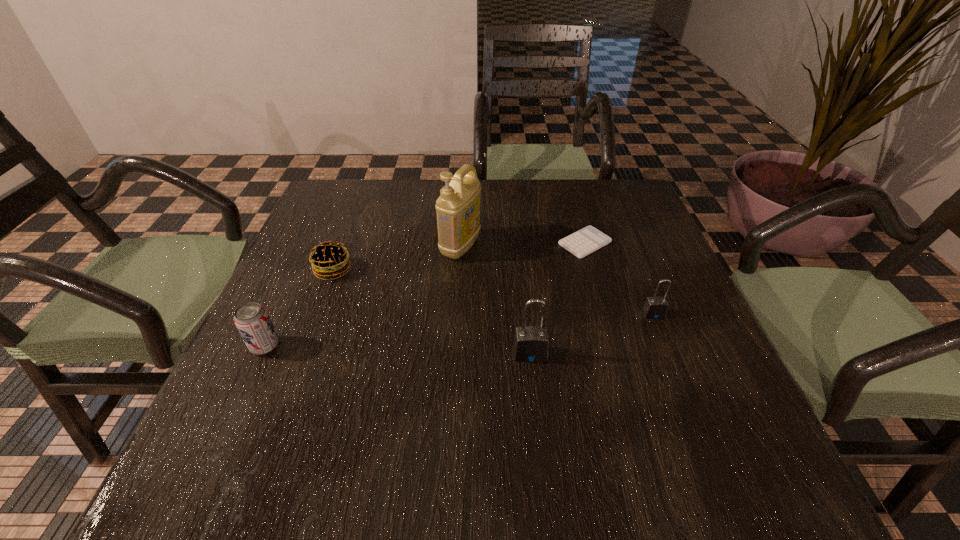
Find the location of a particular element. This screenshot has width=960, height=540. vacant area that lies between the detergent and the second shortest object is located at coordinates (396, 258).

The width and height of the screenshot is (960, 540). What are the coordinates of `vacant point located between the shorter padlock and the taller padlock` in the screenshot? It's located at point(591,334).

Where is `vacant space that is in between the detergent and the fourth farthest object`? Image resolution: width=960 pixels, height=540 pixels. vacant space that is in between the detergent and the fourth farthest object is located at coordinates (x=557, y=280).

Image resolution: width=960 pixels, height=540 pixels. In order to click on empty space that is in between the detergent and the second object from right to left in this screenshot , I will do (522, 245).

Identify the location of unoccupied area between the second shortest object and the nearer padlock. (432, 312).

I want to click on free space between the shorter padlock and the leftmost object, so click(459, 330).

Identify which object is located as the third nearest to the second shortest object. Please provide its 2D coordinates. Your answer should be formatted as a tuple, i.e. [(x, y)], where the tuple contains the x and y coordinates of a point satisfying the conditions above.

[(531, 344)]

Where is `object that stands as the third closest to the farther padlock`? Image resolution: width=960 pixels, height=540 pixels. object that stands as the third closest to the farther padlock is located at coordinates (458, 207).

Where is `free space that satisfies the following two spatial constraints: 1. on the back side of the second shortest object; 2. on the right side of the leftmost object`? free space that satisfies the following two spatial constraints: 1. on the back side of the second shortest object; 2. on the right side of the leftmost object is located at coordinates tap(300, 270).

Identify the location of vacant space that satisfies the following two spatial constraints: 1. on the back side of the patty; 2. on the left side of the leftmost object. The width and height of the screenshot is (960, 540). (300, 270).